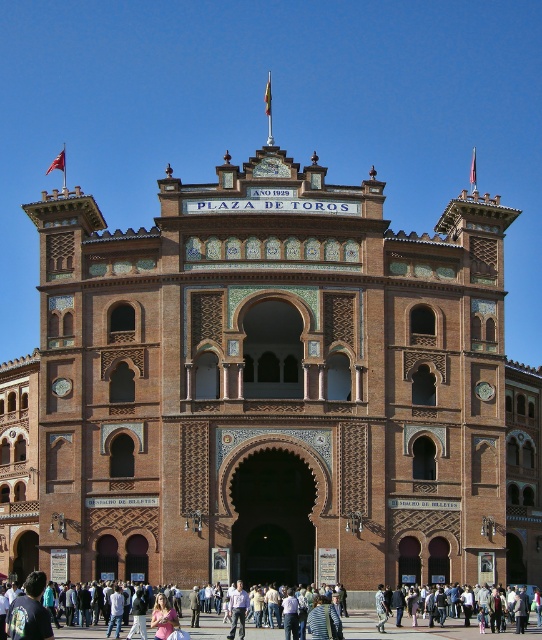
Question: Which of the following is the farthest from the observer?

Choices:
 (A) dark blue shirt at lower left
 (B) light brown leather jacket at lower center
 (C) light pink fabric dress at lower center
 (D) light blue shirt at center

Answer: (B)

Question: Can you confirm if light pink fabric dress at lower center is positioned above dark blue shirt at lower left?

Choices:
 (A) no
 (B) yes

Answer: (A)

Question: Does light brown leather jacket at lower center have a lesser width compared to dark blue shirt at lower left?

Choices:
 (A) no
 (B) yes

Answer: (A)

Question: Which point is closer to the camera?

Choices:
 (A) (537, 595)
 (B) (29, 605)

Answer: (B)

Question: Which object appears closest to the camera in this image?

Choices:
 (A) light blue shirt at center
 (B) light pink fabric dress at lower center

Answer: (A)

Question: Observing the image, what is the correct spatial positioning of light pink fabric dress at lower center in reference to light brown leather jacket at lower center?

Choices:
 (A) left
 (B) right

Answer: (A)